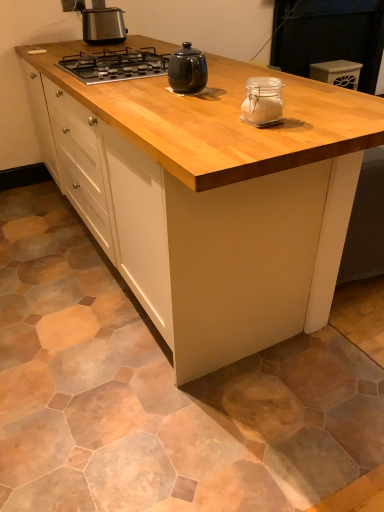
Question: Is black glass gas stove at upper center not within natural wood cabinet at center?

Choices:
 (A) yes
 (B) no

Answer: (B)

Question: From a real-world perspective, does black glass gas stove at upper center stand above natural wood cabinet at center?

Choices:
 (A) yes
 (B) no

Answer: (A)

Question: Is the position of black glass gas stove at upper center more distant than that of natural wood cabinet at center?

Choices:
 (A) no
 (B) yes

Answer: (B)

Question: Is natural wood cabinet at center at the back of black glass gas stove at upper center?

Choices:
 (A) no
 (B) yes

Answer: (A)

Question: Is black glass gas stove at upper center closer to the viewer compared to natural wood cabinet at center?

Choices:
 (A) no
 (B) yes

Answer: (A)

Question: From the image's perspective, does black glass gas stove at upper center appear lower than natural wood cabinet at center?

Choices:
 (A) no
 (B) yes

Answer: (A)

Question: Are white plastic container at upper right and black glass gas stove at upper center beside each other?

Choices:
 (A) yes
 (B) no

Answer: (B)

Question: Can you confirm if white plastic container at upper right is taller than black glass gas stove at upper center?

Choices:
 (A) no
 (B) yes

Answer: (B)

Question: Does white plastic container at upper right contain black glass gas stove at upper center?

Choices:
 (A) no
 (B) yes

Answer: (A)

Question: Is white plastic container at upper right facing away from black glass gas stove at upper center?

Choices:
 (A) yes
 (B) no

Answer: (B)

Question: Considering the relative sizes of white plastic container at upper right and black glass gas stove at upper center in the image provided, is white plastic container at upper right wider than black glass gas stove at upper center?

Choices:
 (A) yes
 (B) no

Answer: (B)

Question: Does white plastic container at upper right appear on the right side of black glass gas stove at upper center?

Choices:
 (A) no
 (B) yes

Answer: (B)

Question: Can you confirm if black glass gas stove at upper center is smaller than clear glass jar at center, which is the first kitchen appliance from right to left?

Choices:
 (A) yes
 (B) no

Answer: (B)